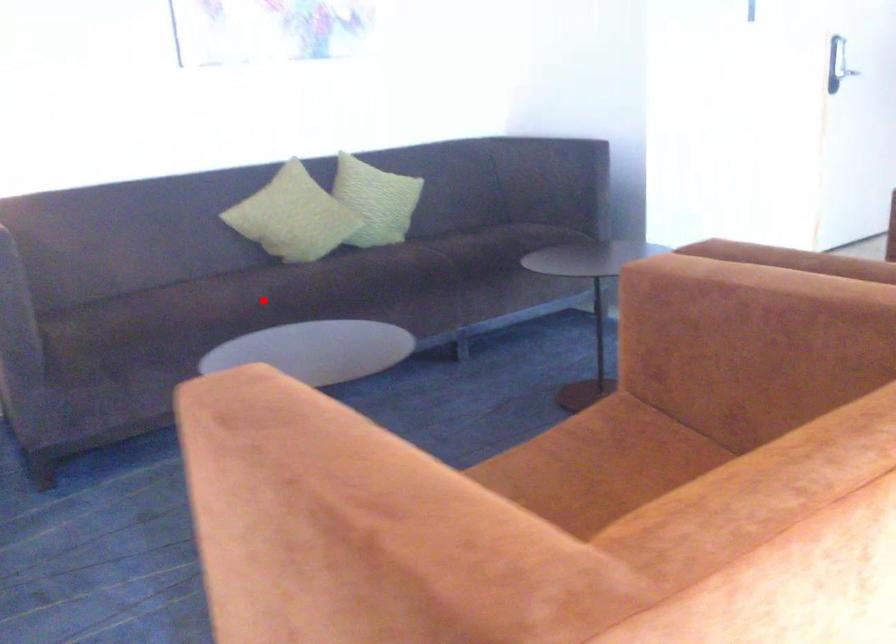
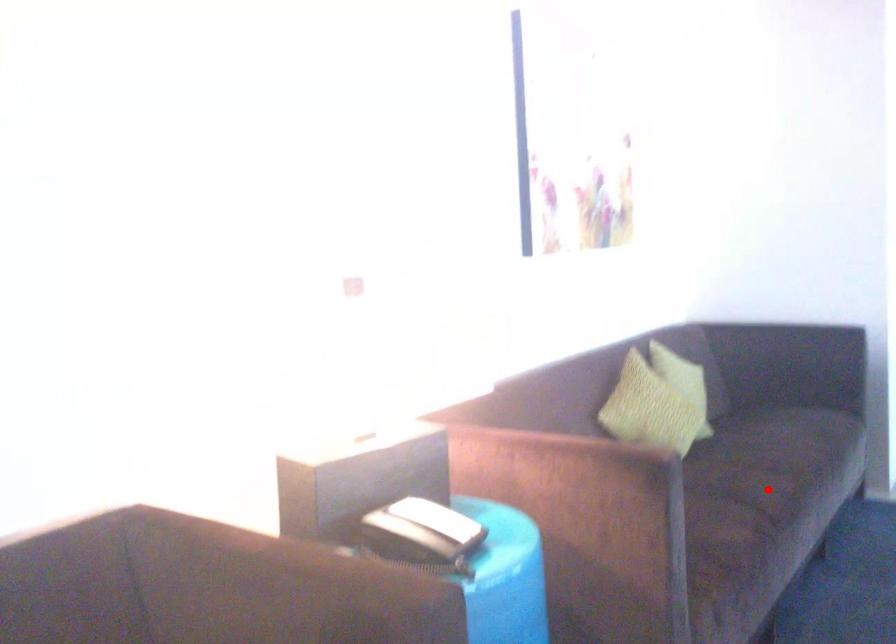
I am providing you with two images of the same scene from different viewpoints. A red point is marked on the first image and another point is marked on the second image. Is the red point in image1 aligned with the point shown in image2?

Yes